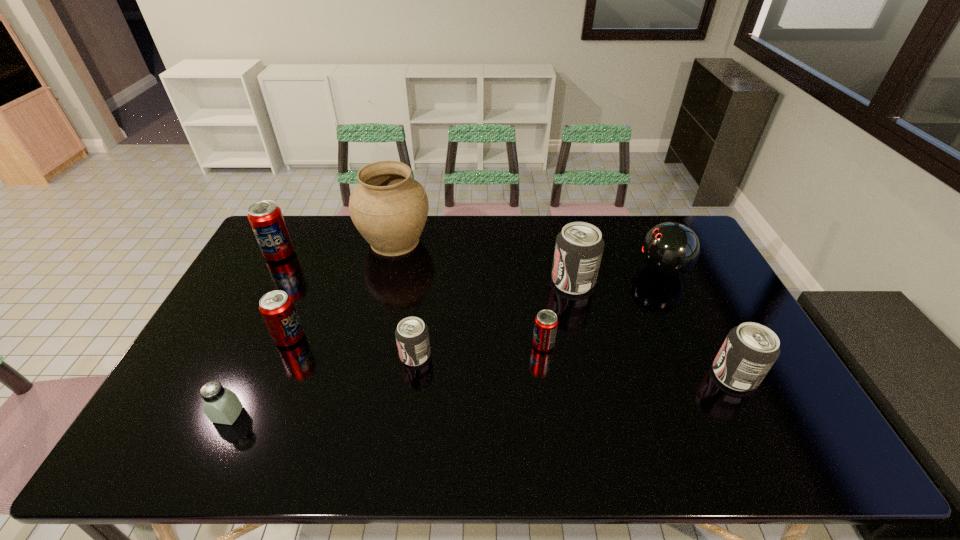
At what (x,y) coordinates should I click in order to perform the action: click on the rightmost red soda can. Please return your answer as a coordinate pair (x, y). Image resolution: width=960 pixels, height=540 pixels. Looking at the image, I should click on (546, 321).

You are a GUI agent. You are given a task and a screenshot of the screen. Output one action in this format:
    pyautogui.click(x=<x>, y=<y>)
    Task: Click on the sixth object from left to right
    The image size is (960, 540).
    Given the screenshot: What is the action you would take?
    pyautogui.click(x=546, y=321)

Identify the location of the leftmost black soda can. (412, 337).

The height and width of the screenshot is (540, 960). I want to click on the fourth soda can from right to left, so click(412, 337).

The image size is (960, 540). Identify the location of the nearest object. (221, 405).

At what (x,y) coordinates should I click in order to perform the action: click on saltshaker. Please return your answer as a coordinate pair (x, y). The image size is (960, 540). Looking at the image, I should click on click(221, 405).

Identify the location of free spot located 0.090m on the right of the tallest object. (456, 241).

You are a GUI agent. You are given a task and a screenshot of the screen. Output one action in this format:
    pyautogui.click(x=<x>, y=<y>)
    Task: Click on the free space located 0.090m on the right of the biggest black soda can
    The image size is (960, 540).
    Given the screenshot: What is the action you would take?
    pyautogui.click(x=622, y=281)

Find the location of a particular element. This screenshot has height=540, width=960. vacant space situated on the front of the biggest red soda can is located at coordinates (241, 327).

The width and height of the screenshot is (960, 540). Identify the location of vacant area situated 0.210m on the surface of the black bowling ball near the finger holes. (575, 269).